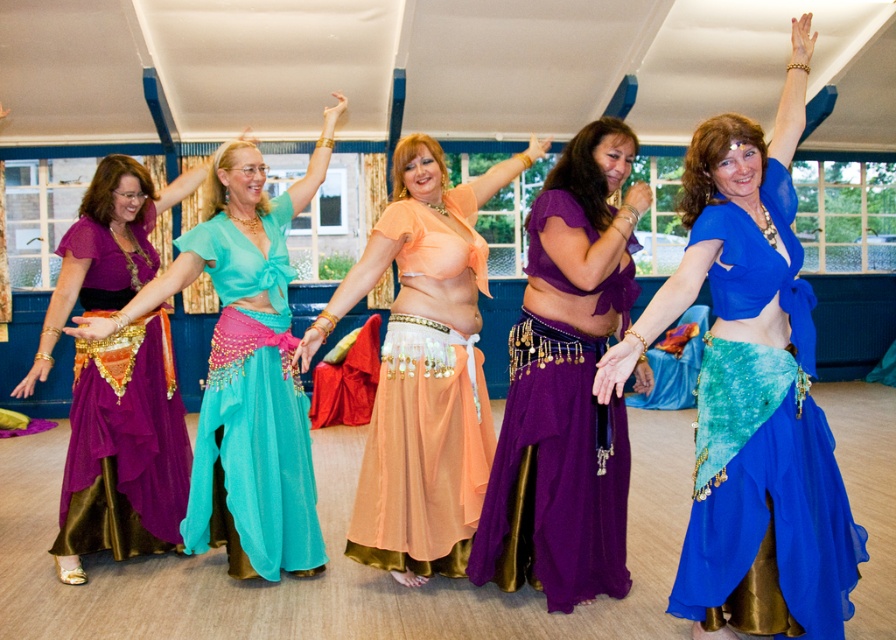
Question: Can you confirm if matte purple skirt at left is thinner than purple satin skirt at left?

Choices:
 (A) no
 (B) yes

Answer: (A)

Question: Where is blue velvet skirt at center located in relation to purple satin skirt at left in the image?

Choices:
 (A) above
 (B) below

Answer: (A)

Question: Can you confirm if blue velvet skirt at center is positioned below matte purple skirt at left?

Choices:
 (A) yes
 (B) no

Answer: (A)

Question: Estimate the real-world distances between objects in this image. Which object is closer to the purple satin skirt at center?

Choices:
 (A) shiny orange fabric at center
 (B) matte purple skirt at left
 (C) teal chiffon skirt at center
 (D) blue velvet skirt at center

Answer: (A)

Question: Estimate the real-world distances between objects in this image. Which object is farther from the blue velvet skirt at center?

Choices:
 (A) purple satin skirt at left
 (B) purple satin skirt at center

Answer: (A)

Question: Which point is farther to the camera?

Choices:
 (A) shiny orange fabric at center
 (B) purple satin skirt at left
 (C) blue velvet skirt at center
 (D) purple satin skirt at center

Answer: (B)